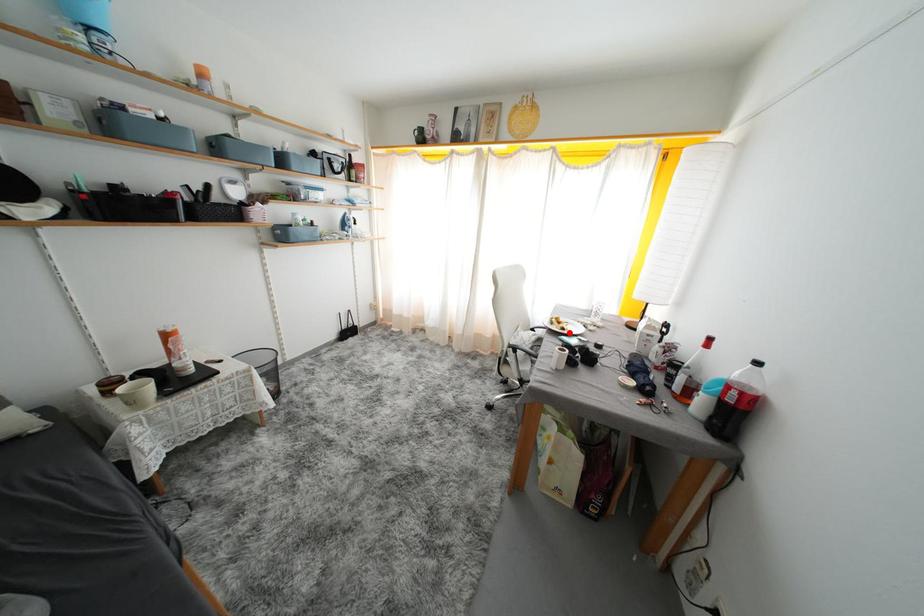
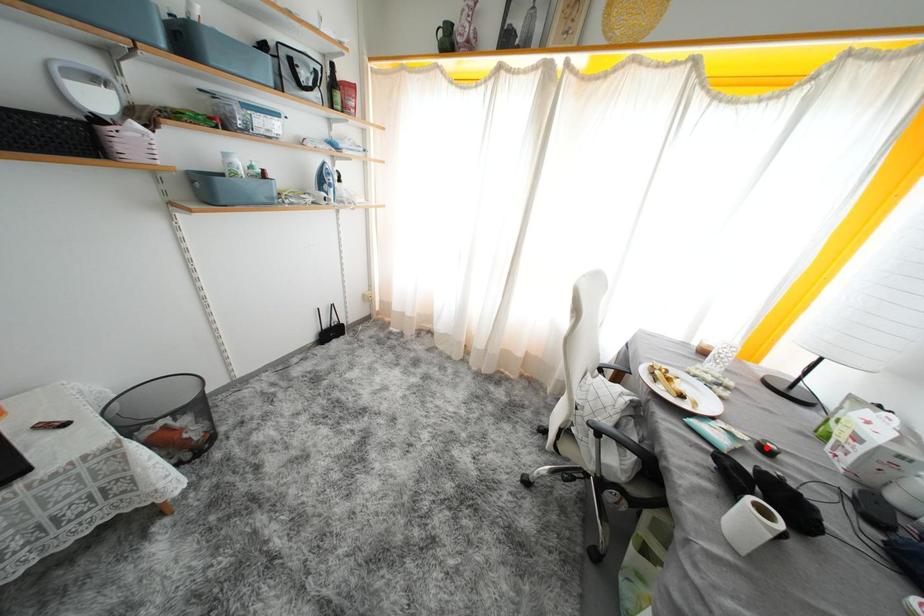
I am providing you with two images of the same scene from different viewpoints. A red point is marked on the first image and another point is marked on the second image. Are the points marked in image1 and image2 representing the same 3D position?

No